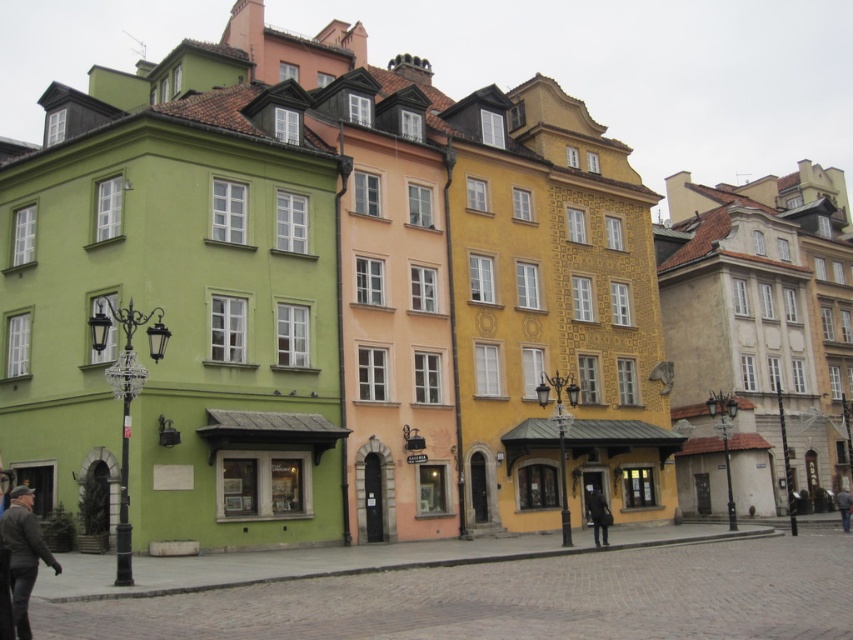
You are a tailor who needs to determine which garment requires more fabric to repair. Based on the scene, which item between the dark gray leather jacket at lower left and the dark gray fabric coat at center would need more fabric for repairs?

The dark gray leather jacket at lower left requires more fabric for repairs because its width is larger than the dark gray fabric coat at center.